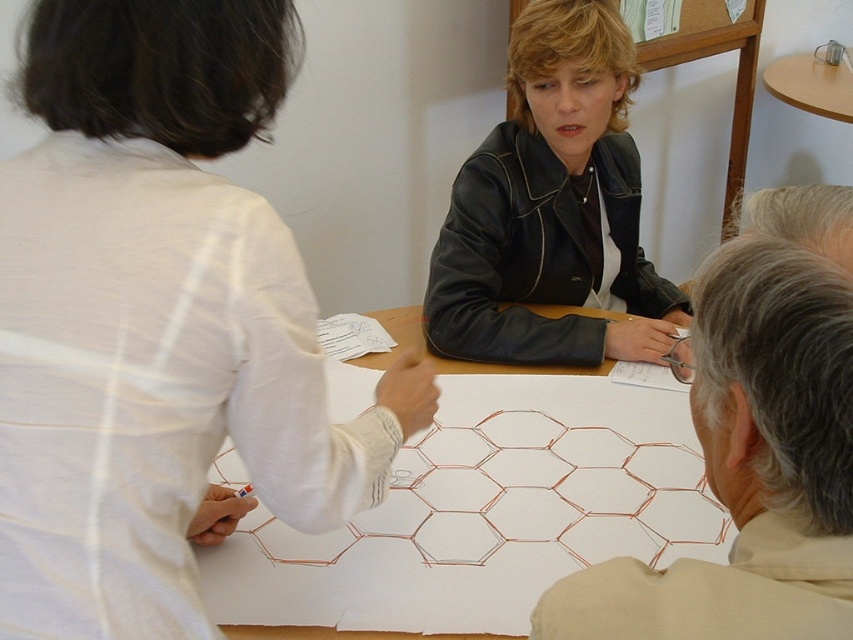
Which is more to the right, white paper at center or gray hair at upper right?

From the viewer's perspective, gray hair at upper right appears more on the right side.

Does white paper at center have a larger size compared to gray hair at upper right?

Correct, white paper at center is larger in size than gray hair at upper right.

Which is in front, point (213, 586) or point (820, 417)?

Point (820, 417)

The height and width of the screenshot is (640, 853). Find the location of `white paper at center`. white paper at center is located at coordinates (482, 516).

Who is positioned more to the right, gray hair at upper right or black leather jacket at center?

Positioned to the right is black leather jacket at center.

Does gray hair at upper right have a smaller size compared to black leather jacket at center?

Correct, gray hair at upper right occupies less space than black leather jacket at center.

Between point (711, 403) and point (527, 324), which one is positioned in front?

Point (711, 403) is more forward.

Identify the location of gray hair at upper right. The height and width of the screenshot is (640, 853). (753, 445).

Is white fabric shirt at upper left closer to the viewer compared to white paper at center?

Yes, it is in front of white paper at center.

Can you confirm if white fabric shirt at upper left is smaller than white paper at center?

Indeed, white fabric shirt at upper left has a smaller size compared to white paper at center.

Who is more forward, (100, 202) or (462, 532)?

Positioned in front is point (100, 202).

Locate an element on the screen. The height and width of the screenshot is (640, 853). white fabric shirt at upper left is located at coordinates (158, 323).